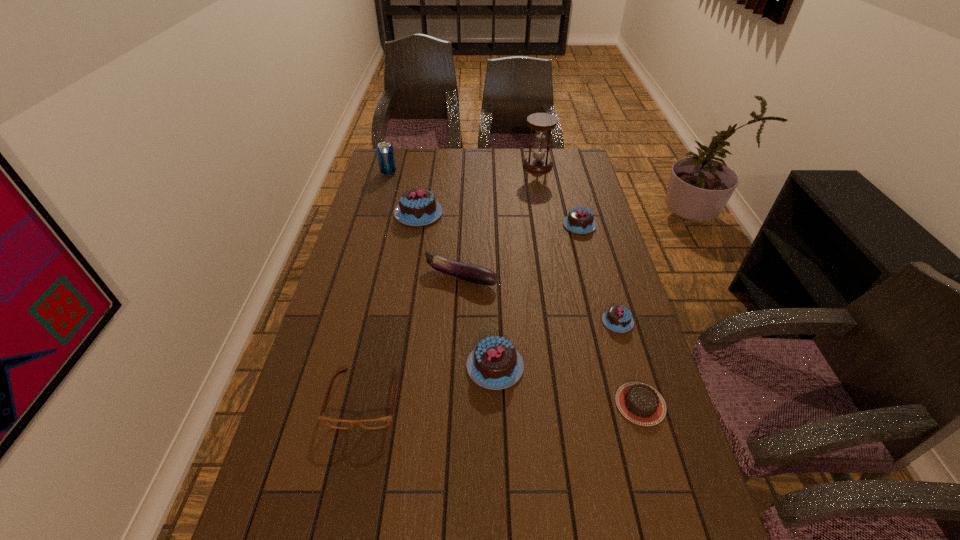
I want to click on spectacles, so (382, 422).

What are the coordinates of `the fourth nearest object` in the screenshot? It's located at (618, 318).

The image size is (960, 540). Identify the location of the second shortest chocolate cake. (618, 318).

Find the location of `the shortest chocolate cake`. the shortest chocolate cake is located at coordinates (640, 403).

This screenshot has height=540, width=960. Find the location of `brown chocolate cake`. brown chocolate cake is located at coordinates (640, 403).

At what (x,y) coordinates should I click in order to perform the action: click on vacant space located 0.380m on the left of the hourglass. Please return your answer as a coordinate pair (x, y). The image size is (960, 540). Looking at the image, I should click on (435, 166).

Locate an element on the screen. vacant space located 0.100m on the right of the blue beer can is located at coordinates (420, 173).

Image resolution: width=960 pixels, height=540 pixels. What are the coordinates of `free space located 0.370m on the right of the tallest chocolate cake` in the screenshot? It's located at (542, 213).

What are the coordinates of `vacant space located on the front of the third smallest pink chocolate cake` in the screenshot? It's located at coord(499,523).

The image size is (960, 540). Identify the location of vacant region located on the back of the third shortest chocolate cake. tap(563, 163).